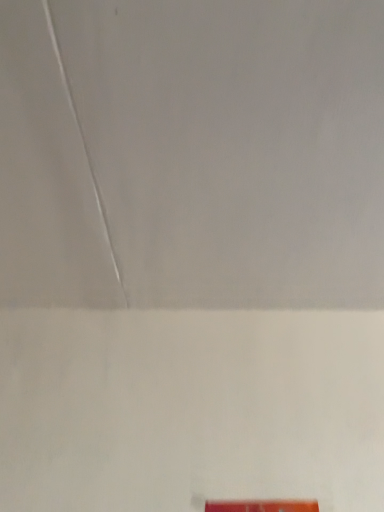
Image resolution: width=384 pixels, height=512 pixels. Describe the element at coordinates (262, 506) in the screenshot. I see `orange glossy sign at lower right` at that location.

Where is `orange glossy sign at lower right`? Image resolution: width=384 pixels, height=512 pixels. orange glossy sign at lower right is located at coordinates (262, 506).

In order to face orange glossy sign at lower right, should I rotate leftwards or rightwards?

It's best to rotate right around 10.636 degrees.

Locate an element on the screen. orange glossy sign at lower right is located at coordinates (262, 506).